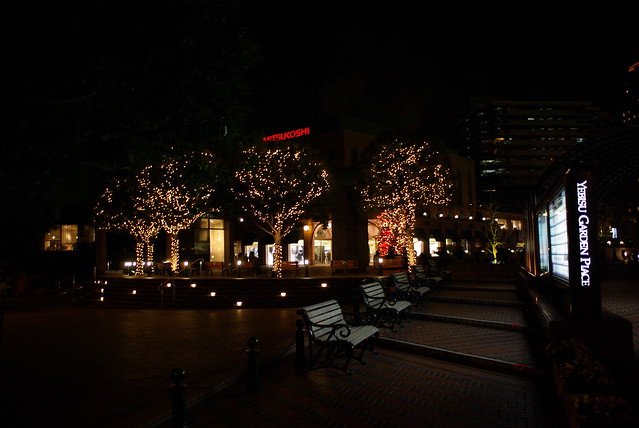
This screenshot has width=639, height=428. Find the location of `christmas lights`. christmas lights is located at coordinates (131, 202), (174, 204), (252, 197), (390, 194).